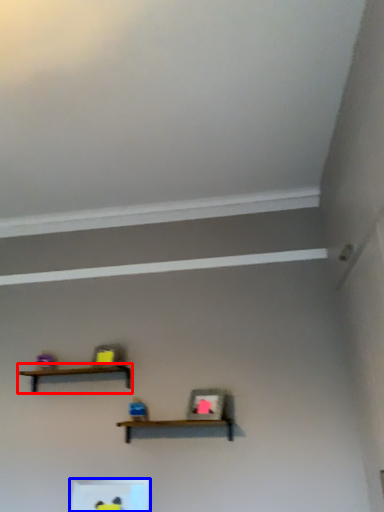
Question: Which point is further to the camera, shelf (highlighted by a red box) or shelf (highlighted by a blue box)?

Choices:
 (A) shelf
 (B) shelf

Answer: (A)